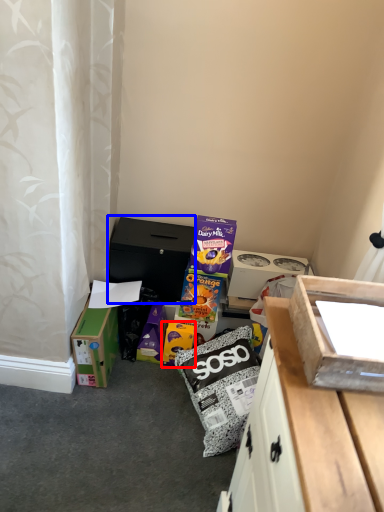
Question: Which object is closer to the camera taking this photo, cardboard box (highlighted by a red box) or cardboard box (highlighted by a blue box)?

Choices:
 (A) cardboard box
 (B) cardboard box

Answer: (A)